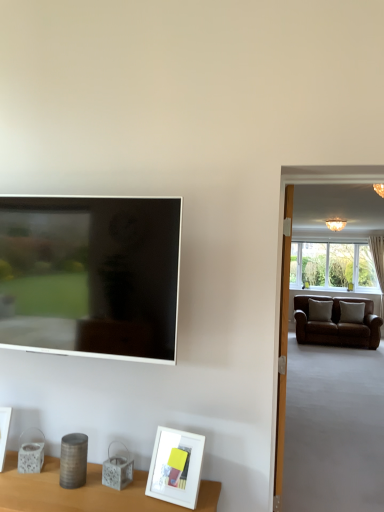
Question: Does white matte picture frame at lower center, acting as the second picture frame starting from the back, come behind matte black tv at left?

Choices:
 (A) yes
 (B) no

Answer: (B)

Question: Would you say white matte picture frame at lower center, placed as the first picture frame when sorted from right to left, is outside matte black tv at left?

Choices:
 (A) no
 (B) yes

Answer: (B)

Question: Is white matte picture frame at lower center, acting as the 2th picture frame starting from the left, to the right of matte black tv at left from the viewer's perspective?

Choices:
 (A) no
 (B) yes

Answer: (B)

Question: Are white matte picture frame at lower center, which ranks as the 1th picture frame in front-to-back order, and matte black tv at left far apart?

Choices:
 (A) no
 (B) yes

Answer: (A)

Question: Is white matte picture frame at lower center, acting as the 2th picture frame starting from the left, at the left side of matte black tv at left?

Choices:
 (A) no
 (B) yes

Answer: (A)

Question: Do you think white matte picture frame at lower center, acting as the second picture frame starting from the back, is within white matte picture frame at lower left, which appears as the 2th picture frame when viewed from the right, or outside of it?

Choices:
 (A) outside
 (B) inside

Answer: (A)

Question: Looking at the image, does white matte picture frame at lower center, acting as the 2th picture frame starting from the left, seem bigger or smaller compared to white matte picture frame at lower left, the 1th picture frame viewed from the back?

Choices:
 (A) big
 (B) small

Answer: (A)

Question: In the image, is white matte picture frame at lower center, acting as the second picture frame starting from the back, on the left side or the right side of white matte picture frame at lower left, the first picture frame in the left-to-right sequence?

Choices:
 (A) left
 (B) right

Answer: (B)

Question: Is white matte picture frame at lower center, acting as the 2th picture frame starting from the left, in front of or behind white matte picture frame at lower left, which appears as the 2th picture frame when viewed from the right, in the image?

Choices:
 (A) behind
 (B) front

Answer: (B)

Question: Considering the positions of white matte picture frame at lower center, acting as the 2th picture frame starting from the left, and matte black tv at left in the image, is white matte picture frame at lower center, acting as the 2th picture frame starting from the left, taller or shorter than matte black tv at left?

Choices:
 (A) tall
 (B) short

Answer: (B)

Question: In terms of size, does white matte picture frame at lower center, acting as the second picture frame starting from the back, appear bigger or smaller than matte black tv at left?

Choices:
 (A) small
 (B) big

Answer: (A)

Question: In terms of width, does white matte picture frame at lower center, acting as the second picture frame starting from the back, look wider or thinner when compared to matte black tv at left?

Choices:
 (A) wide
 (B) thin

Answer: (A)

Question: From a real-world perspective, is white matte picture frame at lower center, placed as the first picture frame when sorted from right to left, physically located above or below matte black tv at left?

Choices:
 (A) below
 (B) above

Answer: (A)

Question: Is matte black tv at left taller or shorter than white matte picture frame at lower left, which appears as the 2th picture frame when viewed from the right?

Choices:
 (A) tall
 (B) short

Answer: (A)

Question: Is matte black tv at left in front of or behind white matte picture frame at lower left, which appears as the 2th picture frame when viewed from the right, in the image?

Choices:
 (A) behind
 (B) front

Answer: (B)